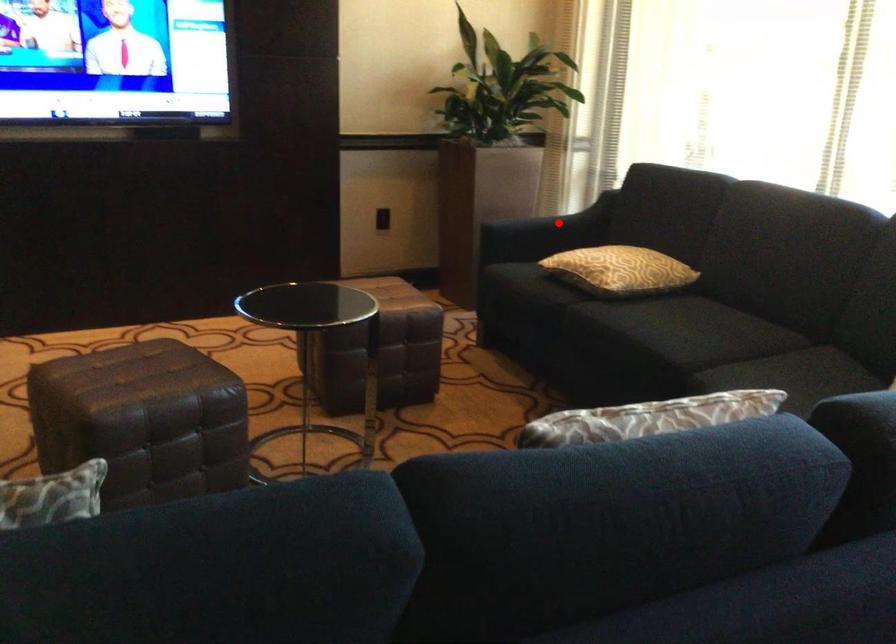
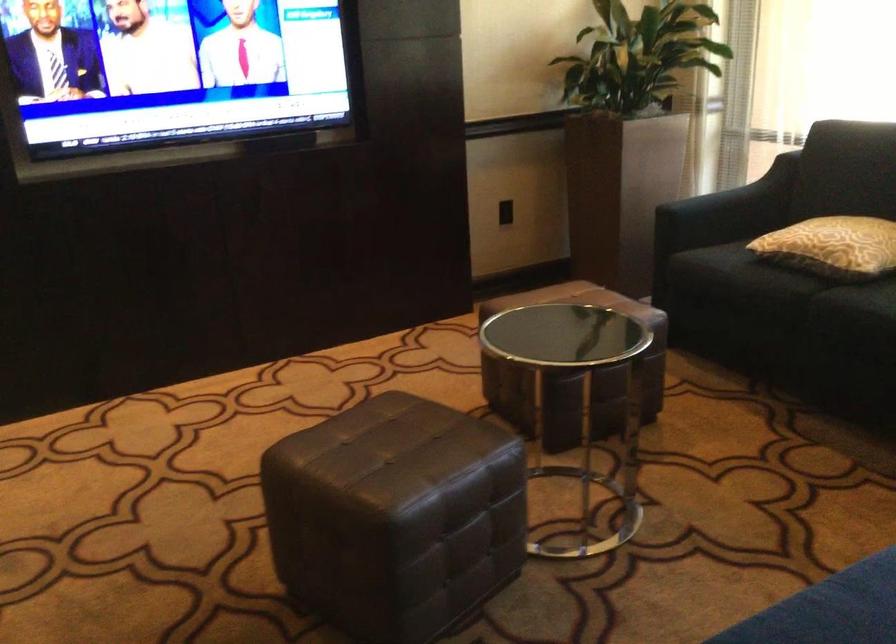
Find the pixel in the second image that matches the highlighted location in the first image.

(742, 196)